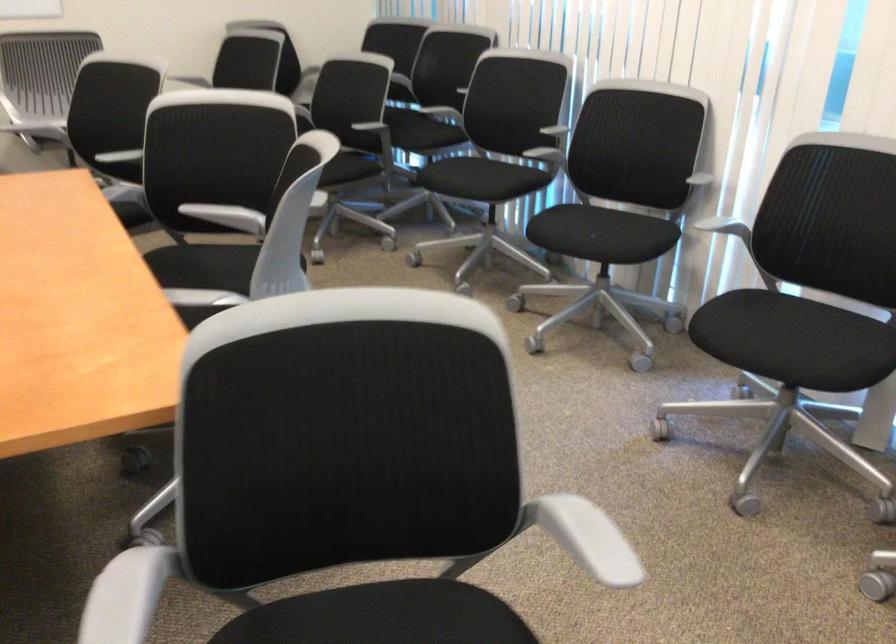
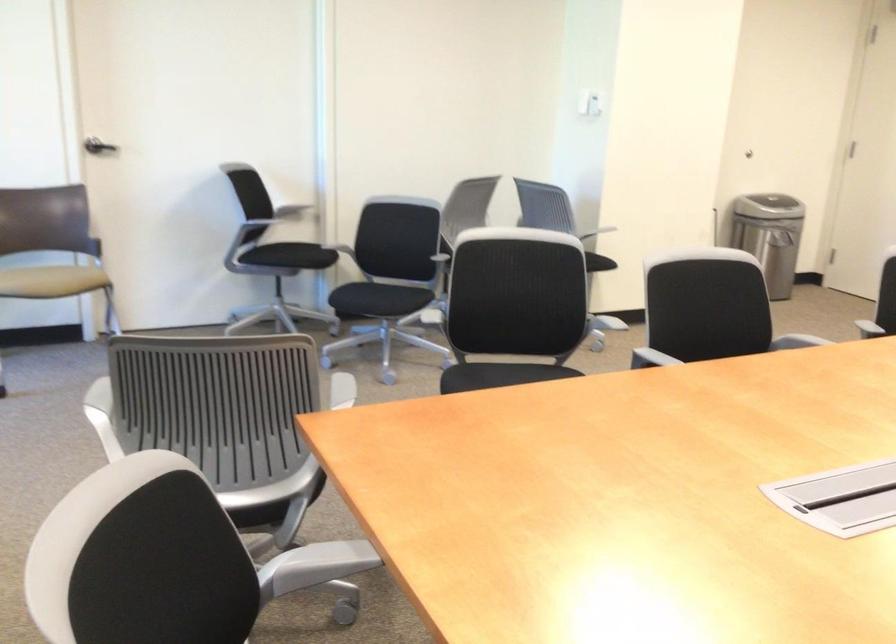
Locate, in the second image, the point that corresponds to [151,288] in the first image.

(320, 562)